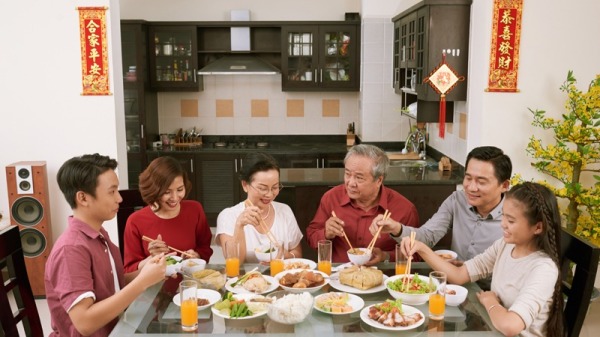
The image size is (600, 337). I want to click on upper cabinets, so click(174, 54), click(328, 49), click(422, 46).